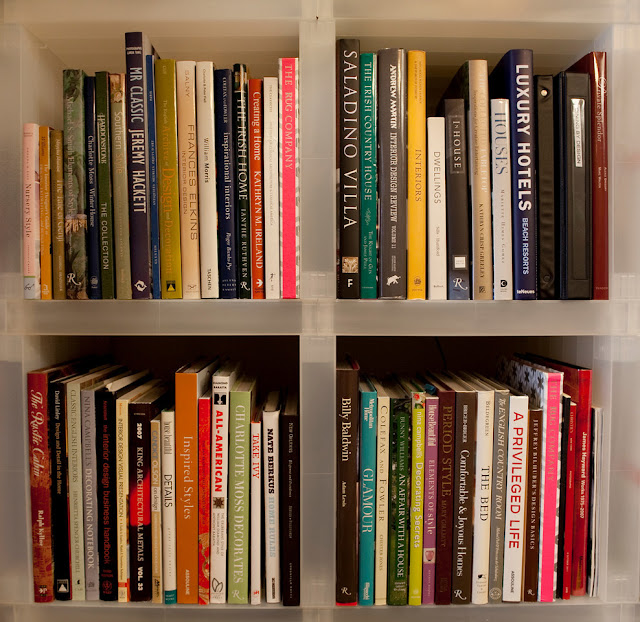
What are the coordinates of `teal books` in the screenshot? It's located at (365, 208), (368, 463).